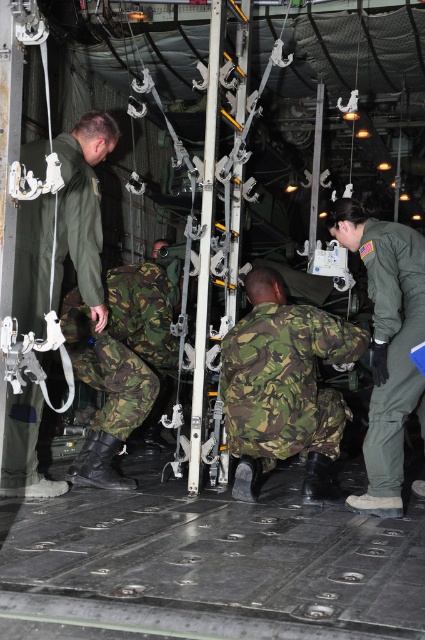
You are a military supply manager who needs to pack two uniforms into a storage container. The camouflage fabric uniform at center and the green matte flight suit at right. Given their sizes, which one will require more space in the container?

The camouflage fabric uniform at center requires more space in the container because it has a larger size compared to the green matte flight suit at right.

You are a military engineer who needs to move a heavy crate from the back of the cargo area to the front. You see two personnel in camouflage fabric uniform at center. How far apart are they?

The two personnel in camouflage fabric uniform at center are 12.05 feet apart.

You are a military engineer who needs to reach the green matte flight suit at right from the camo fabric pants at lower center. Can you walk directly to it without moving any equipment?

The distance between the camo fabric pants at lower center and the green matte flight suit at right is 1.47 meters. Since there is no mention of obstacles in the scene description, you can walk directly to it without moving any equipment.